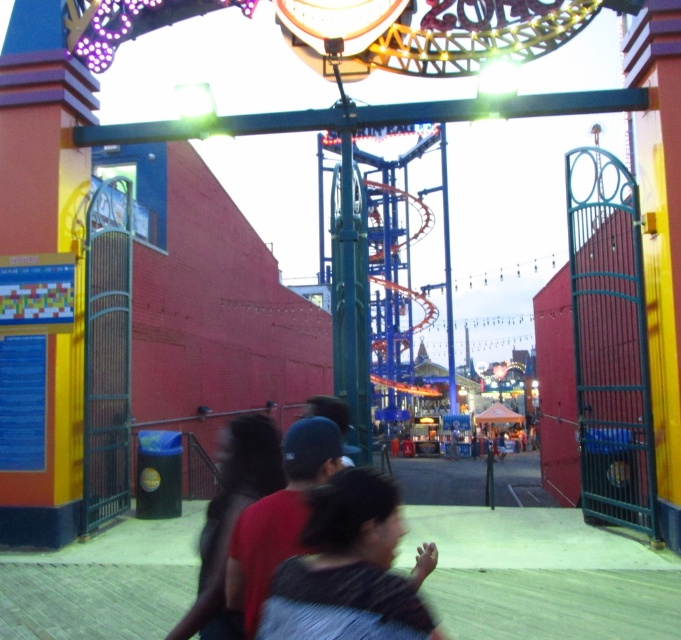
Question: Is blurred dark hair at center in front of dark gray fabric shirt at center?

Choices:
 (A) yes
 (B) no

Answer: (A)

Question: Which point is closer to the camera?

Choices:
 (A) (298, 579)
 (B) (306, 465)

Answer: (A)

Question: Does blurred dark hair at center come behind dark gray fabric shirt at center?

Choices:
 (A) yes
 (B) no

Answer: (B)

Question: Among these objects, which one is farthest from the camera?

Choices:
 (A) blurred dark hair at center
 (B) dark gray fabric shirt at center

Answer: (B)

Question: Is blurred dark hair at center behind dark gray fabric shirt at center?

Choices:
 (A) no
 (B) yes

Answer: (A)